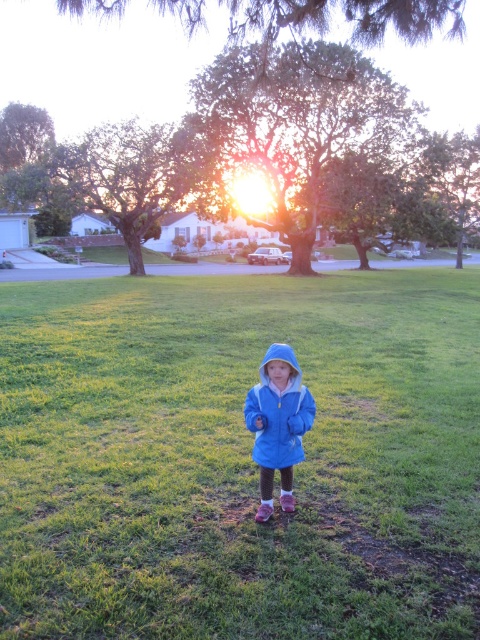
Does blue fleece jacket at center appear on the right side of matte blue jacket at center?

Correct, you'll find blue fleece jacket at center to the right of matte blue jacket at center.

Does blue fleece jacket at center have a larger size compared to matte blue jacket at center?

Yes, blue fleece jacket at center is bigger than matte blue jacket at center.

Is point (66, 570) closer to camera compared to point (284, 460)?

That is True.

The image size is (480, 640). I want to click on blue fleece jacket at center, so click(239, 458).